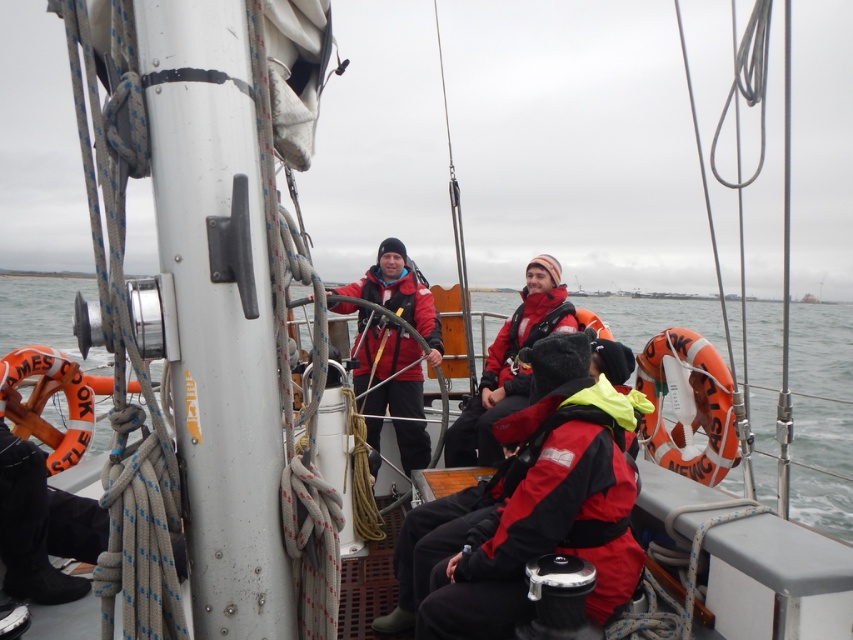
Who is lower down, clear water at center or matte red jacket at center?

matte red jacket at center

Is clear water at center smaller than matte red jacket at center?

Incorrect, clear water at center is not smaller in size than matte red jacket at center.

Which is behind, point (758, 326) or point (405, 262)?

Point (758, 326)

Where is `clear water at center`? The height and width of the screenshot is (640, 853). clear water at center is located at coordinates (821, 385).

Is matte red jacket at center positioned in front of red matte life jacket at center?

Yes.

In the scene shown: Between matte red jacket at center and red matte life jacket at center, which one has more height?

With more height is matte red jacket at center.

Which is behind, point (393, 333) or point (421, 332)?

The point (393, 333) is behind.

Locate an element on the screen. The image size is (853, 640). matte red jacket at center is located at coordinates (390, 381).

How much distance is there between clear water at center and red matte life jacket at center?

clear water at center is 12.98 feet from red matte life jacket at center.

Can you confirm if clear water at center is positioned to the left of red matte life jacket at center?

No, clear water at center is not to the left of red matte life jacket at center.

Does point (804, 436) come closer to viewer compared to point (428, 300)?

No.

Find the location of a particular element. Image resolution: width=853 pixels, height=640 pixels. clear water at center is located at coordinates (821, 385).